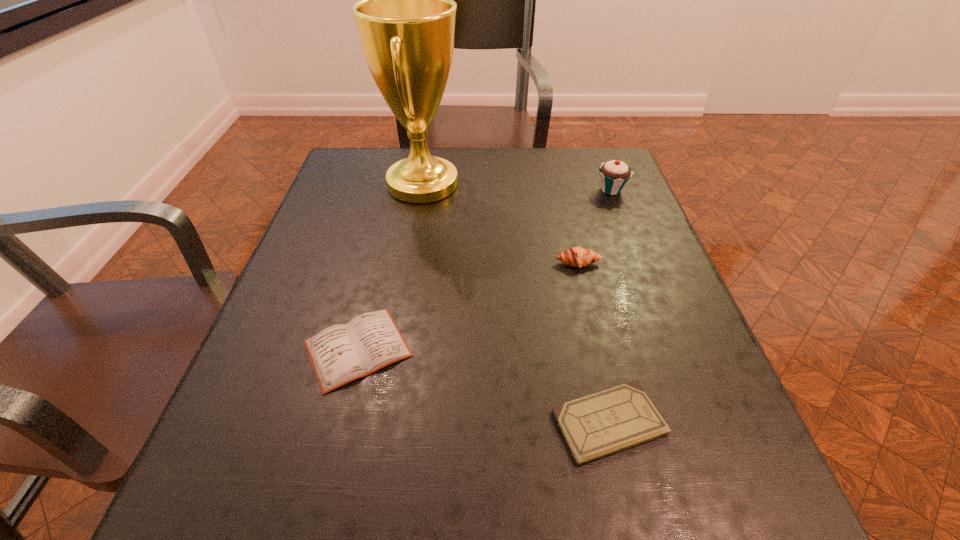
This screenshot has width=960, height=540. I want to click on free point that satisfies the following two spatial constraints: 1. by the handles of the checkbook; 2. on the right side of the award, so click(382, 422).

Image resolution: width=960 pixels, height=540 pixels. I want to click on vacant area that satisfies the following two spatial constraints: 1. by the handles of the award; 2. on the left side of the cupcake, so click(x=421, y=190).

At what (x,y) coordinates should I click in order to perform the action: click on vacant space that satisfies the following two spatial constraints: 1. by the handles of the tallest object; 2. on the left side of the cupcake. Please return your answer as a coordinate pair (x, y). Image resolution: width=960 pixels, height=540 pixels. Looking at the image, I should click on (421, 190).